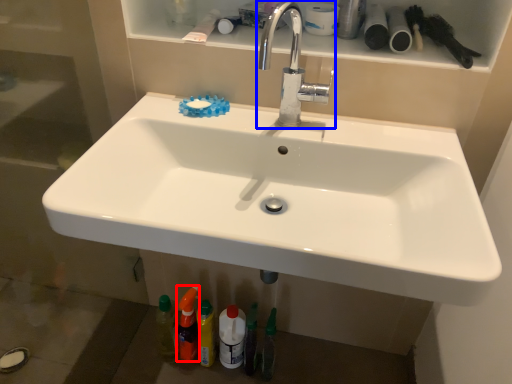
Question: Which object is further to the camera taking this photo, toiletry (highlighted by a red box) or tap (highlighted by a blue box)?

Choices:
 (A) toiletry
 (B) tap

Answer: (A)